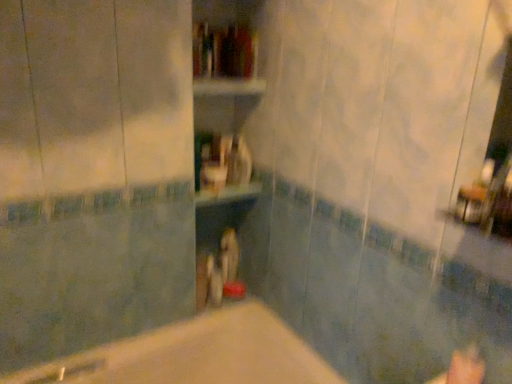
Question: Does beige matte bathtub at center have a larger size compared to wooden shelf at center?

Choices:
 (A) no
 (B) yes

Answer: (B)

Question: Is the position of beige matte bathtub at center more distant than that of wooden shelf at center?

Choices:
 (A) no
 (B) yes

Answer: (A)

Question: Considering the relative positions of beige matte bathtub at center and wooden shelf at center in the image provided, is beige matte bathtub at center to the left of wooden shelf at center from the viewer's perspective?

Choices:
 (A) yes
 (B) no

Answer: (A)

Question: Is wooden shelf at center surrounded by beige matte bathtub at center?

Choices:
 (A) yes
 (B) no

Answer: (B)

Question: From the image's perspective, is beige matte bathtub at center located above wooden shelf at center?

Choices:
 (A) yes
 (B) no

Answer: (B)

Question: Is beige matte bathtub at center at the right side of wooden shelf at center?

Choices:
 (A) yes
 (B) no

Answer: (B)

Question: Does beige matte bathtub at center come behind hardcover book at center?

Choices:
 (A) no
 (B) yes

Answer: (A)

Question: Does beige matte bathtub at center have a larger size compared to hardcover book at center?

Choices:
 (A) yes
 (B) no

Answer: (A)

Question: Does beige matte bathtub at center appear on the right side of hardcover book at center?

Choices:
 (A) no
 (B) yes

Answer: (A)

Question: Is hardcover book at center surrounded by beige matte bathtub at center?

Choices:
 (A) yes
 (B) no

Answer: (B)

Question: Considering the relative positions of beige matte bathtub at center and hardcover book at center in the image provided, is beige matte bathtub at center to the left of hardcover book at center from the viewer's perspective?

Choices:
 (A) no
 (B) yes

Answer: (B)

Question: Is beige matte bathtub at center smaller than hardcover book at center?

Choices:
 (A) yes
 (B) no

Answer: (B)

Question: Is hardcover book at center completely or partially inside wooden shelf at center?

Choices:
 (A) no
 (B) yes

Answer: (B)